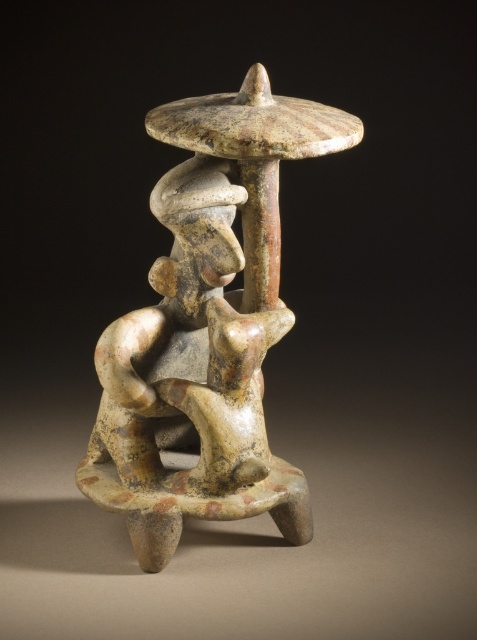
Question: Which point appears farthest from the camera in this image?

Choices:
 (A) (167, 129)
 (B) (112, 392)

Answer: (B)

Question: Is speckled clay figure at center wider than matte ceramic figure at center?

Choices:
 (A) no
 (B) yes

Answer: (B)

Question: Is speckled clay figure at center below matte ceramic figure at center?

Choices:
 (A) yes
 (B) no

Answer: (A)

Question: Is speckled clay figure at center wider than matte ceramic figure at center?

Choices:
 (A) no
 (B) yes

Answer: (B)